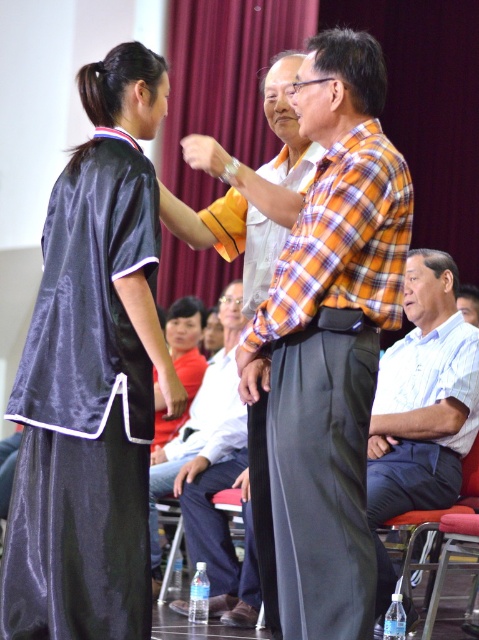
You are a photographer at the event and need to ensure both the silky black robe at center and the white cotton shirt at center are visible in the photo. Which clothing item should be positioned closer to the camera to ensure both are fully visible?

The silky black robe at center is not as tall as the white cotton shirt at center, so positioning the silky black robe at center closer to the camera will ensure both are fully visible.

You are standing at the center of the image. Where is the satin black robe at left located relative to your position?

The satin black robe at left is located at point 0.641 on the x axis and 0.175 on the y axis, so it is to the left and lower part of the image from your central position.

You are standing in the center of the room and see the point at coordinates (328,385). What object is located at that point?

The point at coordinates (328,385) corresponds to the silky black robe at center.